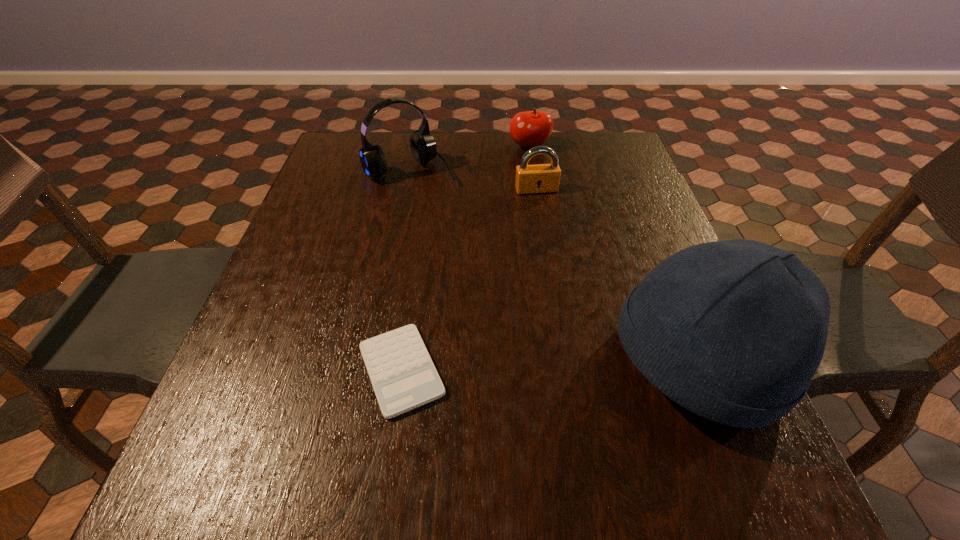
I want to click on free space on the desktop that is between the shortest object and the tallest object and is positioned to unlock the padlock from the front, so click(594, 365).

Where is `vacant spot on the desktop that is between the shortest object and the tallest object and is positioned on the ear cushions of the fourth shortest object`? The height and width of the screenshot is (540, 960). vacant spot on the desktop that is between the shortest object and the tallest object and is positioned on the ear cushions of the fourth shortest object is located at coordinates (575, 366).

The height and width of the screenshot is (540, 960). In order to click on free space on the desktop that is between the calculator and the rightmost object and is positioned on the stem of the apple in this screenshot , I will do `click(548, 366)`.